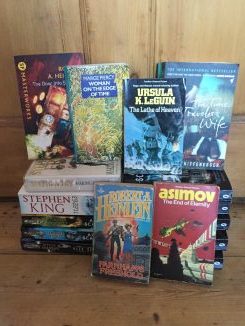
This screenshot has width=245, height=326. I want to click on front books, so click(129, 229), click(205, 237).